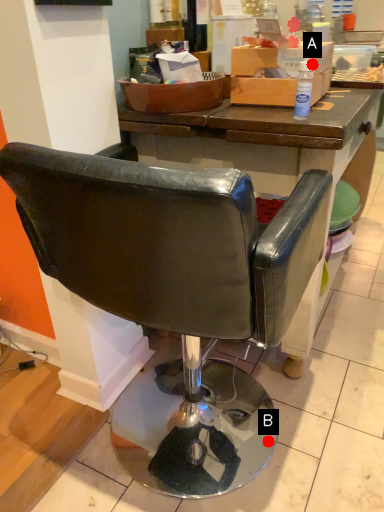
Question: Two points are circled on the image, labeled by A and B beside each circle. Which point is farther to the camera?

Choices:
 (A) A is further
 (B) B is further

Answer: (B)